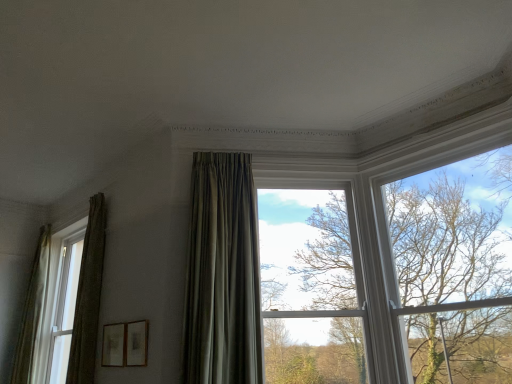
Find the location of a particular element. satin green curtain at center, marked as the 1th curtain in a right-to-left arrangement is located at coordinates (222, 274).

Locate an element on the screen. green textured curtain at left, the second curtain from the right is located at coordinates (88, 296).

What do you see at coordinates (114, 345) in the screenshot?
I see `matte gold picture frame at lower left, which is the 2th picture frame from right to left` at bounding box center [114, 345].

What is the approximate height of wooden picture frame at lower center, arranged as the first picture frame when viewed from the right?

It is 12.36 inches.

Locate an element on the screen. matte white window at left, the second window viewed from the front is located at coordinates (89, 295).

Could you measure the distance between green textured curtain at left, the second curtain in the left-to-right sequence, and bare branches at upper right?

green textured curtain at left, the second curtain in the left-to-right sequence, and bare branches at upper right are 2.69 meters apart from each other.

Which is farther, (77, 361) or (449, 350)?

Positioned behind is point (77, 361).

Is green textured curtain at left, the 2th curtain viewed from the front, wider than bare branches at upper right?

No, green textured curtain at left, the 2th curtain viewed from the front, is not wider than bare branches at upper right.

Considering the positions of objects green textured curtain at left, acting as the 2th curtain starting from the back, and bare branches at upper right in the image provided, who is more to the right, green textured curtain at left, acting as the 2th curtain starting from the back, or bare branches at upper right?

Positioned to the right is bare branches at upper right.

Considering the relative sizes of green textured curtain at left, acting as the 2th curtain starting from the back, and silky green curtain at left, marked as the 1th curtain in a left-to-right arrangement, in the image provided, is green textured curtain at left, acting as the 2th curtain starting from the back, thinner than silky green curtain at left, marked as the 1th curtain in a left-to-right arrangement,?

Yes, green textured curtain at left, acting as the 2th curtain starting from the back, is thinner than silky green curtain at left, marked as the 1th curtain in a left-to-right arrangement.

Who is taller, green textured curtain at left, acting as the 2th curtain starting from the back, or silky green curtain at left, the 1th curtain viewed from the back?

Standing taller between the two is silky green curtain at left, the 1th curtain viewed from the back.

In the scene shown: Is silky green curtain at left, marked as the 1th curtain in a left-to-right arrangement, inside green textured curtain at left, acting as the 2th curtain starting from the back?

That's incorrect, silky green curtain at left, marked as the 1th curtain in a left-to-right arrangement, is not inside green textured curtain at left, acting as the 2th curtain starting from the back.

Is green textured curtain at left, the second curtain from the right, oriented towards silky green curtain at left, the 1th curtain viewed from the back?

No, green textured curtain at left, the second curtain from the right, is not aimed at silky green curtain at left, the 1th curtain viewed from the back.

Can bare branches at upper right be found inside clear glass window at center, which appears as the second window when viewed from the left?

No, bare branches at upper right is not inside clear glass window at center, which appears as the second window when viewed from the left.

From the picture: Considering the sizes of objects clear glass window at center, which is counted as the 2th window, starting from the back, and bare branches at upper right in the image provided, who is wider, clear glass window at center, which is counted as the 2th window, starting from the back, or bare branches at upper right?

With larger width is bare branches at upper right.

Looking at this image, who is smaller, clear glass window at center, which is counted as the 2th window, starting from the back, or bare branches at upper right?

clear glass window at center, which is counted as the 2th window, starting from the back.

Is green textured curtain at left, acting as the 2th curtain starting from the back, taller than wooden picture frame at lower center, which is counted as the 2th picture frame, starting from the left?

Correct, green textured curtain at left, acting as the 2th curtain starting from the back, is much taller as wooden picture frame at lower center, which is counted as the 2th picture frame, starting from the left.

Is green textured curtain at left, the second curtain in the left-to-right sequence, oriented away from wooden picture frame at lower center, arranged as the first picture frame when viewed from the right?

No.

From a real-world perspective, relative to wooden picture frame at lower center, which is counted as the 2th picture frame, starting from the left, is green textured curtain at left, the 2th curtain viewed from the front, vertically above or below?

green textured curtain at left, the 2th curtain viewed from the front, is above wooden picture frame at lower center, which is counted as the 2th picture frame, starting from the left.

Can you confirm if green textured curtain at left, acting as the 2th curtain starting from the back, is positioned to the right of wooden picture frame at lower center, arranged as the first picture frame when viewed from the right?

Incorrect, green textured curtain at left, acting as the 2th curtain starting from the back, is not on the right side of wooden picture frame at lower center, arranged as the first picture frame when viewed from the right.

Is satin green curtain at center, the 1th curtain in the front-to-back sequence, facing away from matte gold picture frame at lower left, which is the 2th picture frame from right to left?

No.

Between satin green curtain at center, marked as the 1th curtain in a right-to-left arrangement, and matte gold picture frame at lower left, which is the 2th picture frame from right to left, which one has less height?

With less height is matte gold picture frame at lower left, which is the 2th picture frame from right to left.

From the image's perspective, is satin green curtain at center, the third curtain when ordered from back to front, over matte gold picture frame at lower left, placed as the first picture frame when sorted from left to right?

Indeed, from the image's perspective, satin green curtain at center, the third curtain when ordered from back to front, is shown above matte gold picture frame at lower left, placed as the first picture frame when sorted from left to right.

At what (x,y) coordinates should I click in order to perform the action: click on tree below the satin green curtain at center, arranged as the third curtain when viewed from the left (from a real-world perspective). Please return your answer as a coordinate pair (x, y). Looking at the image, I should click on (454, 271).

Does bare branches at upper right turn towards satin green curtain at center, the third curtain when ordered from back to front?

No, bare branches at upper right is not facing towards satin green curtain at center, the third curtain when ordered from back to front.

Which object is thinner, bare branches at upper right or satin green curtain at center, arranged as the third curtain when viewed from the left?

Thinner between the two is bare branches at upper right.

Is bare branches at upper right not inside satin green curtain at center, the third curtain when ordered from back to front?

Absolutely, bare branches at upper right is external to satin green curtain at center, the third curtain when ordered from back to front.

Does point (196, 244) come farther from viewer compared to point (102, 232)?

No, (196, 244) is in front of (102, 232).

Is satin green curtain at center, marked as the 1th curtain in a right-to-left arrangement, closer to the viewer compared to green textured curtain at left, the 2th curtain viewed from the front?

Yes, satin green curtain at center, marked as the 1th curtain in a right-to-left arrangement, is in front of green textured curtain at left, the 2th curtain viewed from the front.

Would you say green textured curtain at left, the second curtain from the right, is part of satin green curtain at center, marked as the 1th curtain in a right-to-left arrangement,'s contents?

No, green textured curtain at left, the second curtain from the right, is not a part of satin green curtain at center, marked as the 1th curtain in a right-to-left arrangement.

Locate an element on the screen. The image size is (512, 384). curtain that is the 2nd one above the bare branches at upper right (from a real-world perspective) is located at coordinates (88, 296).

The width and height of the screenshot is (512, 384). Identify the location of curtain that is the 1st one when counting rightward from the silky green curtain at left, the third curtain from the front. (88, 296).

When comparing their distances from wooden picture frame at lower center, arranged as the first picture frame when viewed from the right, does bare branches at upper right or matte white window at left, the 1th window when ordered from back to front, seem closer?

Based on the image, matte white window at left, the 1th window when ordered from back to front, appears to be nearer to wooden picture frame at lower center, arranged as the first picture frame when viewed from the right.

Based on the photo, considering their positions, is clear glass window at center, the 1th window positioned from the front, positioned further to satin green curtain at center, the 1th curtain in the front-to-back sequence, than green textured curtain at left, the 2th curtain viewed from the front?

green textured curtain at left, the 2th curtain viewed from the front, is positioned further to the anchor satin green curtain at center, the 1th curtain in the front-to-back sequence.

Looking at the image, which one is located closer to clear glass window at center, which is counted as the 2th window, starting from the back, wooden picture frame at lower center, which is counted as the 2th picture frame, starting from the left, or matte white window at left, marked as the 2th window in a right-to-left arrangement?

The object closer to clear glass window at center, which is counted as the 2th window, starting from the back, is wooden picture frame at lower center, which is counted as the 2th picture frame, starting from the left.

When comparing their distances from bare branches at upper right, does silky green curtain at left, which is counted as the third curtain, starting from the right, or clear glass window at center, which is counted as the 2th window, starting from the back, seem further?

The object further to bare branches at upper right is silky green curtain at left, which is counted as the third curtain, starting from the right.

When comparing their distances from green textured curtain at left, the second curtain in the left-to-right sequence, does matte gold picture frame at lower left, placed as the first picture frame when sorted from left to right, or bare branches at upper right seem further?

bare branches at upper right is further to green textured curtain at left, the second curtain in the left-to-right sequence.

Considering their positions, is satin green curtain at center, marked as the 1th curtain in a right-to-left arrangement, positioned closer to silky green curtain at left, which is counted as the third curtain, starting from the right, than clear glass window at center, which is counted as the 2th window, starting from the back?

Based on the image, satin green curtain at center, marked as the 1th curtain in a right-to-left arrangement, appears to be nearer to silky green curtain at left, which is counted as the third curtain, starting from the right.

From the image, which object appears to be nearer to wooden picture frame at lower center, arranged as the first picture frame when viewed from the right, green textured curtain at left, the second curtain in the left-to-right sequence, or satin green curtain at center, the third curtain when ordered from back to front?

The object closer to wooden picture frame at lower center, arranged as the first picture frame when viewed from the right, is satin green curtain at center, the third curtain when ordered from back to front.

When comparing their distances from satin green curtain at center, the third curtain when ordered from back to front, does green textured curtain at left, the 2th curtain viewed from the front, or clear glass window at center, which appears as the second window when viewed from the left, seem further?

green textured curtain at left, the 2th curtain viewed from the front, is further to satin green curtain at center, the third curtain when ordered from back to front.

Where is `curtain between silky green curtain at left, which is counted as the third curtain, starting from the right, and satin green curtain at center, the third curtain when ordered from back to front`? Image resolution: width=512 pixels, height=384 pixels. curtain between silky green curtain at left, which is counted as the third curtain, starting from the right, and satin green curtain at center, the third curtain when ordered from back to front is located at coordinates (88, 296).

The width and height of the screenshot is (512, 384). Identify the location of window between green textured curtain at left, acting as the 2th curtain starting from the back, and bare branches at upper right from left to right. (311, 286).

This screenshot has height=384, width=512. I want to click on curtain situated between silky green curtain at left, which is counted as the third curtain, starting from the right, and matte gold picture frame at lower left, placed as the first picture frame when sorted from left to right, from left to right, so click(x=88, y=296).

The width and height of the screenshot is (512, 384). I want to click on curtain between matte white window at left, the 1th window when ordered from back to front, and satin green curtain at center, arranged as the third curtain when viewed from the left, in the horizontal direction, so click(x=88, y=296).